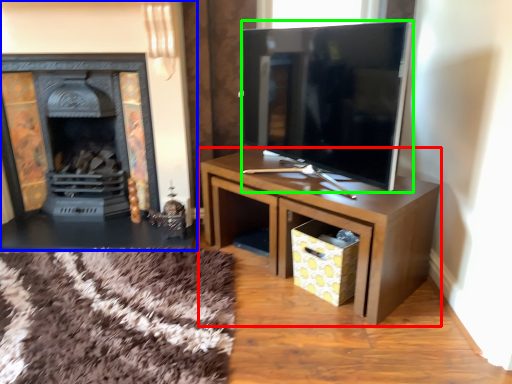
Question: Which object is positioned closest to table (highlighted by a red box)? Select from fireplace (highlighted by a blue box) and television (highlighted by a green box).

Choices:
 (A) fireplace
 (B) television

Answer: (B)